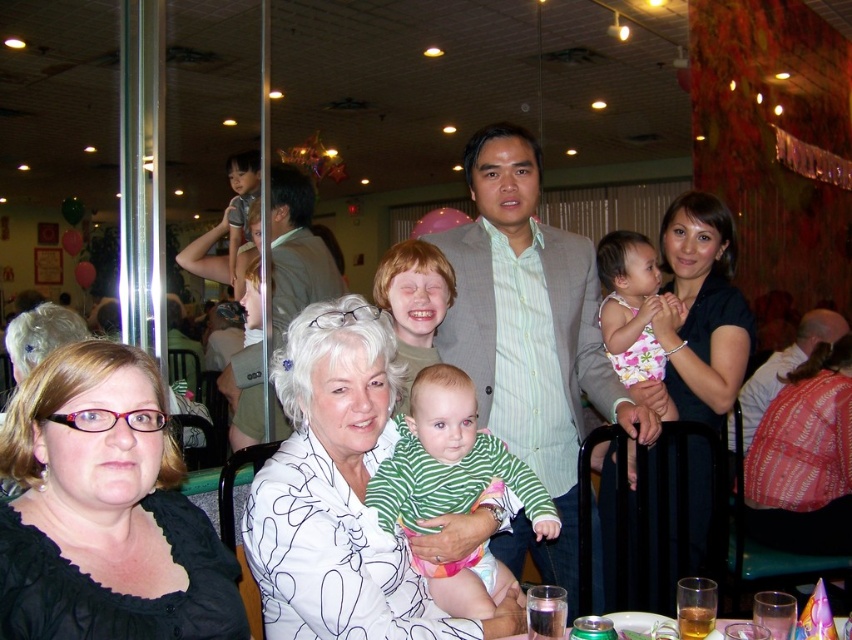
Is white dotted dress at center behind light brown hair at right?

That is False.

Does white dotted dress at center have a lesser width compared to light brown hair at right?

Yes, white dotted dress at center is thinner than light brown hair at right.

Describe the element at coordinates (701, 308) in the screenshot. This screenshot has height=640, width=852. I see `white dotted dress at center` at that location.

Identify the location of white dotted dress at center. The width and height of the screenshot is (852, 640). (701, 308).

Does black matte shirt at lower left appear on the left side of light gray suit at center?

Correct, you'll find black matte shirt at lower left to the left of light gray suit at center.

Consider the image. Can you confirm if black matte shirt at lower left is positioned above light gray suit at center?

No.

Measure the distance between point (217, 561) and camera.

Point (217, 561) and camera are 4.19 feet apart.

I want to click on black matte shirt at lower left, so click(x=105, y=513).

Is light gray suit at center closer to camera compared to white dotted dress at center?

That is True.

Does light gray suit at center have a smaller size compared to white dotted dress at center?

Incorrect, light gray suit at center is not smaller in size than white dotted dress at center.

Between point (557, 451) and point (698, 209), which one is positioned behind?

Positioned behind is point (698, 209).

The image size is (852, 640). What are the coordinates of `light gray suit at center` in the screenshot? It's located at (528, 337).